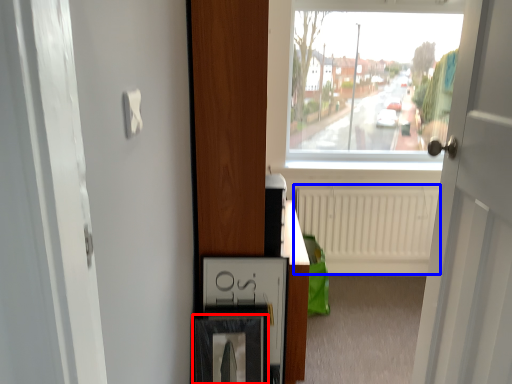
Question: Which of the following is the farthest to the observer, picture frame (highlighted by a red box) or radiator (highlighted by a blue box)?

Choices:
 (A) picture frame
 (B) radiator

Answer: (B)